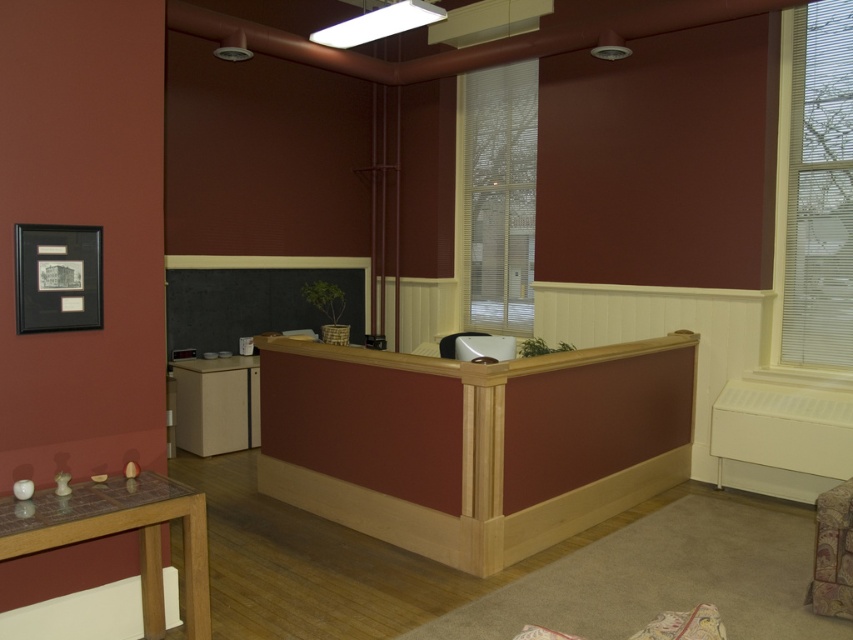
Question: Is white blinds at upper right to the right of matte glass table at lower left from the viewer's perspective?

Choices:
 (A) no
 (B) yes

Answer: (B)

Question: Among these objects, which one is nearest to the camera?

Choices:
 (A) matte glass table at lower left
 (B) floral fabric ottoman at lower right
 (C) white mesh window at center
 (D) matte wood armchair at center

Answer: (A)

Question: Based on their relative distances, which object is nearer to the floral fabric ottoman at lower right?

Choices:
 (A) matte wood armchair at center
 (B) white mesh window at center
 (C) white blinds at upper right
 (D) matte glass table at lower left

Answer: (A)

Question: Among these objects, which one is farthest from the camera?

Choices:
 (A) matte wood armchair at center
 (B) matte glass table at lower left

Answer: (A)

Question: From the image, what is the correct spatial relationship of white blinds at upper right in relation to floral fabric ottoman at lower right?

Choices:
 (A) left
 (B) right

Answer: (B)

Question: Where is white blinds at upper right located in relation to matte wood cabinet at lower left in the image?

Choices:
 (A) left
 (B) right

Answer: (B)